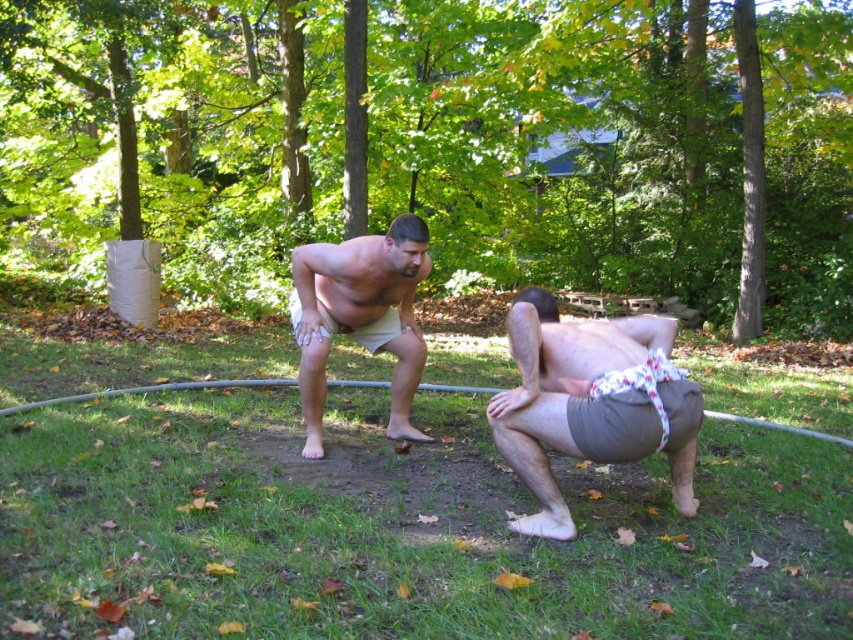
Is green grass at center to the right of beige cotton shorts at center from the viewer's perspective?

Indeed, green grass at center is positioned on the right side of beige cotton shorts at center.

Is green grass at center closer to camera compared to beige cotton shorts at center?

That is True.

Identify the location of green grass at center. Image resolution: width=853 pixels, height=640 pixels. pyautogui.click(x=399, y=528).

Is green grass at center positioned in front of brown cotton shorts at lower right?

Yes, it is in front of brown cotton shorts at lower right.

How distant is green grass at center from brown cotton shorts at lower right?

They are 36.34 inches apart.

Which is behind, point (86, 456) or point (590, 376)?

The point (86, 456) is more distant.

This screenshot has height=640, width=853. Identify the location of green grass at center. (399, 528).

Who is more distant from viewer, (515, 392) or (347, 307)?

The point (347, 307) is more distant.

In the scene shown: Is brown cotton shorts at lower right shorter than beige cotton shorts at center?

Yes.

Does point (657, 428) lie in front of point (404, 220)?

Yes.

The image size is (853, 640). Identify the location of brown cotton shorts at lower right. [589, 403].